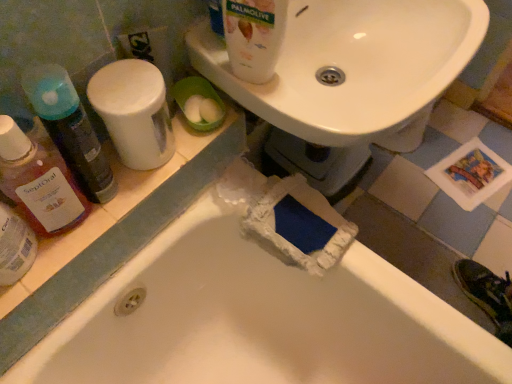
Question: From the image's perspective, is white glossy bottle at upper center, which ranks as the 1th cleaning product in right-to-left order, on white glossy sink at upper center?

Choices:
 (A) yes
 (B) no

Answer: (A)

Question: Is white glossy bottle at upper center, which is the 4th cleaning product in left-to-right order, turned away from white glossy sink at upper center?

Choices:
 (A) no
 (B) yes

Answer: (A)

Question: Does white glossy bottle at upper center, which ranks as the 1th cleaning product in right-to-left order, have a larger size compared to white glossy sink at upper center?

Choices:
 (A) no
 (B) yes

Answer: (A)

Question: Considering the relative sizes of white glossy bottle at upper center, which ranks as the 1th cleaning product in right-to-left order, and white glossy sink at upper center in the image provided, is white glossy bottle at upper center, which ranks as the 1th cleaning product in right-to-left order, shorter than white glossy sink at upper center?

Choices:
 (A) yes
 (B) no

Answer: (B)

Question: From a real-world perspective, does white glossy bottle at upper center, which ranks as the 1th cleaning product in right-to-left order, sit lower than white glossy sink at upper center?

Choices:
 (A) no
 (B) yes

Answer: (A)

Question: Looking at their shapes, would you say translucent plastic mouthwash at left is wider or thinner than white glossy bottle at upper center, which is the 4th cleaning product in left-to-right order?

Choices:
 (A) wide
 (B) thin

Answer: (B)

Question: Looking at the image, does translucent plastic mouthwash at left seem bigger or smaller compared to white glossy bottle at upper center, which is the 4th cleaning product in left-to-right order?

Choices:
 (A) big
 (B) small

Answer: (B)

Question: In the image, is translucent plastic mouthwash at left on the left side or the right side of white glossy bottle at upper center, which is the 4th cleaning product in left-to-right order?

Choices:
 (A) right
 (B) left

Answer: (B)

Question: From a real-world perspective, is translucent plastic mouthwash at left physically located above or below white glossy bottle at upper center, which is the 4th cleaning product in left-to-right order?

Choices:
 (A) below
 (B) above

Answer: (A)

Question: Does point (145, 162) appear closer or farther from the camera than point (282, 380)?

Choices:
 (A) farther
 (B) closer

Answer: (B)

Question: Is white plastic container at upper left, which appears as the second cleaning product when viewed from the right, situated inside white matte bathtub at lower left or outside?

Choices:
 (A) inside
 (B) outside

Answer: (B)

Question: Based on their positions, is white plastic container at upper left, which appears as the second cleaning product when viewed from the right, located to the left or right of white matte bathtub at lower left?

Choices:
 (A) right
 (B) left

Answer: (B)

Question: In terms of height, does white plastic container at upper left, which ranks as the third cleaning product in left-to-right order, look taller or shorter compared to white matte bathtub at lower left?

Choices:
 (A) tall
 (B) short

Answer: (B)

Question: Which is correct: translucent plastic mouthwash at left is inside white plastic container at upper left, which ranks as the third cleaning product in left-to-right order, or outside of it?

Choices:
 (A) outside
 (B) inside

Answer: (A)

Question: Considering the positions of point (6, 284) and point (125, 160), is point (6, 284) closer or farther from the camera than point (125, 160)?

Choices:
 (A) closer
 (B) farther

Answer: (A)